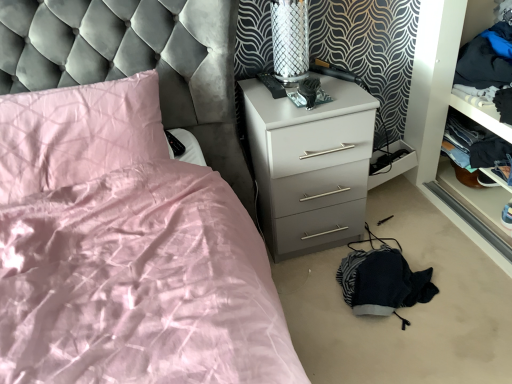
Locate an element on the screen. This screenshot has height=384, width=512. vacant area to the right of white glossy chest of drawers at center is located at coordinates (406, 226).